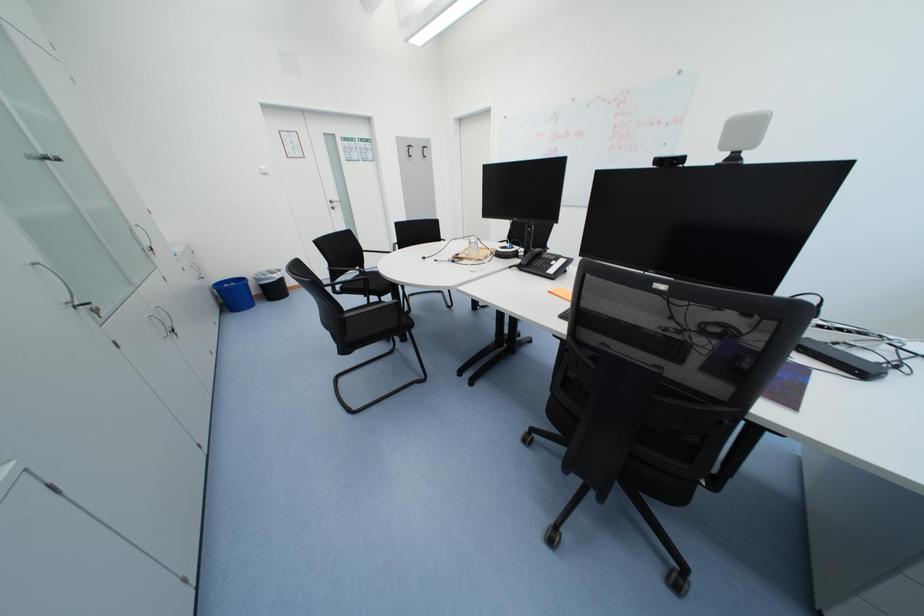
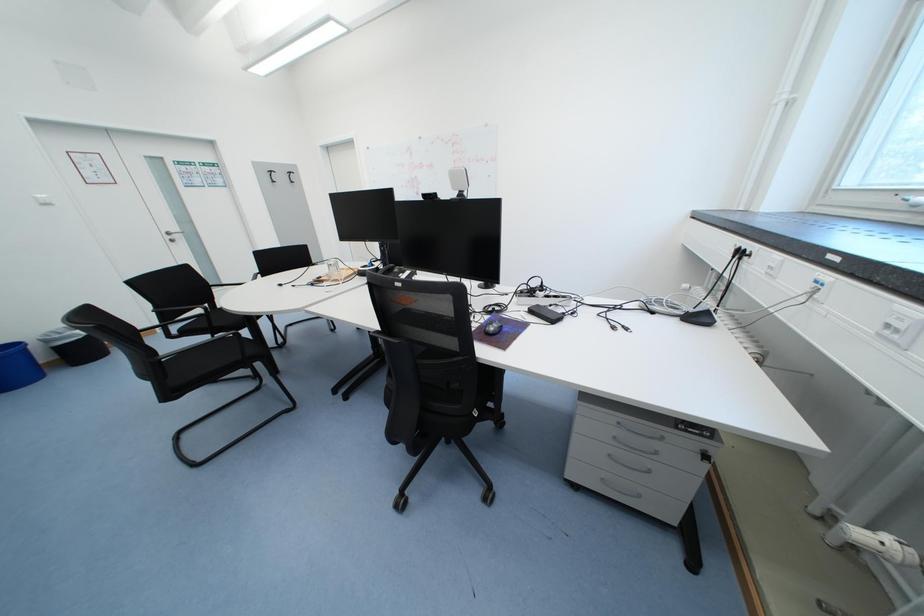
Which direction would the cameraman need to move to produce the second image?

The cameraman moved toward right, backward.